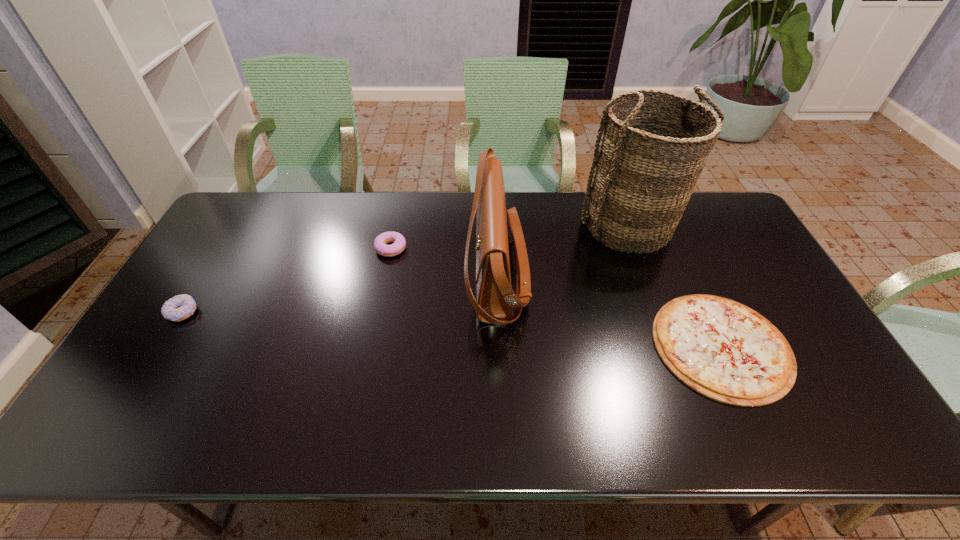
Locate an element on the screen. This screenshot has height=540, width=960. basket is located at coordinates (642, 177).

The height and width of the screenshot is (540, 960). I want to click on the third object from left to right, so click(x=495, y=301).

Locate an element on the screen. This screenshot has height=540, width=960. the second tallest object is located at coordinates (495, 301).

The image size is (960, 540). I want to click on the right doughnut, so click(x=399, y=243).

Identify the location of the second object from left to right. The image size is (960, 540). (399, 243).

Locate an element on the screen. The image size is (960, 540). the left doughnut is located at coordinates (180, 307).

Locate an element on the screen. This screenshot has width=960, height=540. the leftmost object is located at coordinates (180, 307).

Locate an element on the screen. the shortest object is located at coordinates (722, 349).

Where is `vacant space positioned on the left of the tallest object`? This screenshot has width=960, height=540. vacant space positioned on the left of the tallest object is located at coordinates (462, 226).

You are a GUI agent. You are given a task and a screenshot of the screen. Output one action in this format:
    pyautogui.click(x=<x>, y=<y>)
    Task: Click on the vacant space located on the front flap of the second tallest object
    
    Given the screenshot: What is the action you would take?
    pyautogui.click(x=351, y=274)